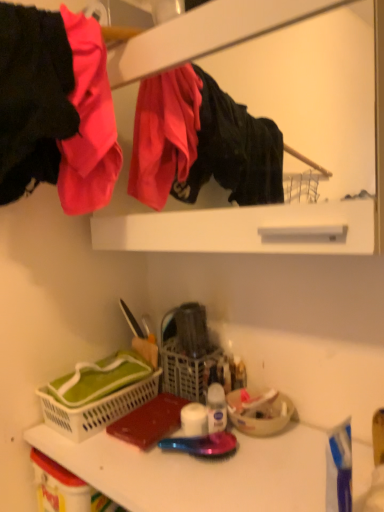
I want to click on vacant area that is in front of white matte toilet paper at center, so (205, 482).